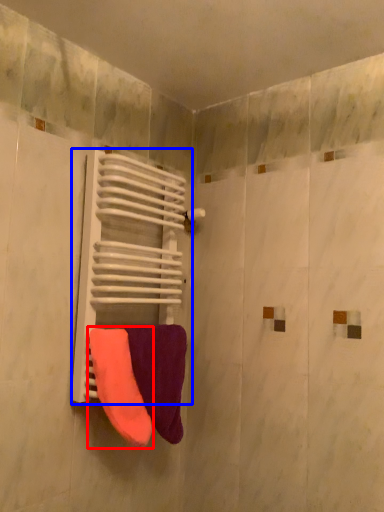
Question: Among these objects, which one is nearest to the camera, towel (highlighted by a red box) or radiator (highlighted by a blue box)?

Choices:
 (A) towel
 (B) radiator

Answer: (A)